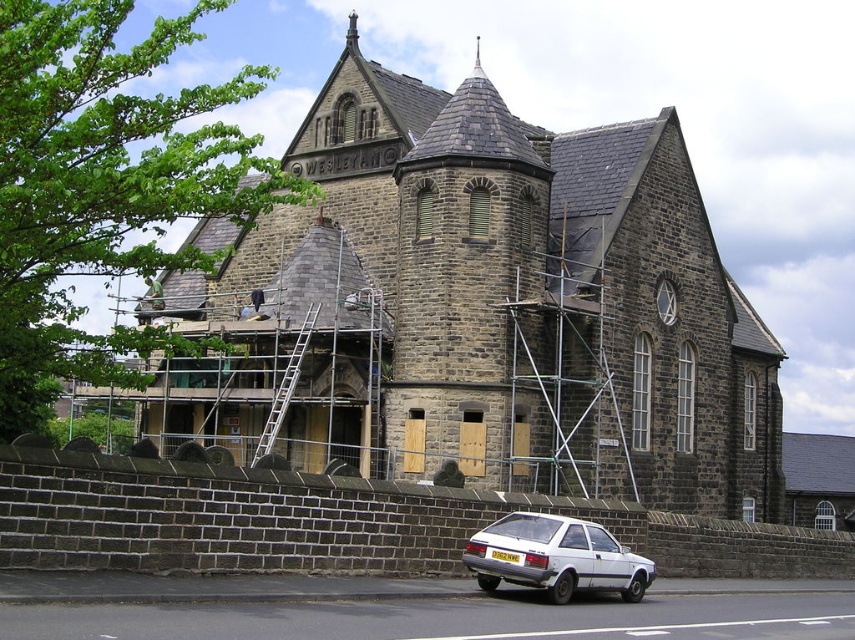
You are a delivery driver who needs to park your white matte hatchback at lower center as close as possible to the dark gray stone church at center. Based on their positions, which side of the church should you park the car on to be nearest to it?

The dark gray stone church at center is to the right of the white matte hatchback at lower center, so to park as close as possible, you should position the white matte hatchback at lower center to the left side of the dark gray stone church at center.

You are a delivery driver who needs to park your white matte hatchback at lower center as close as possible to the entrance of the building. Given the current layout, is there enough space between the scaffolding and the building to park the vehicle?

The white matte hatchback at lower center is located at point coordinates (x=555, y=557), but the exact spatial relationship between the vehicle and the scaffolding isn not provided in the Objects Description. Therefore, it is impossible to determine if there is sufficient space to park the vehicle near the entrance based on the given information.

You are standing at the entrance of the building and see a point marked at coordinates (555, 557). What object is located at that point?

The point at coordinates (555, 557) indicates the white matte hatchback at lower center.